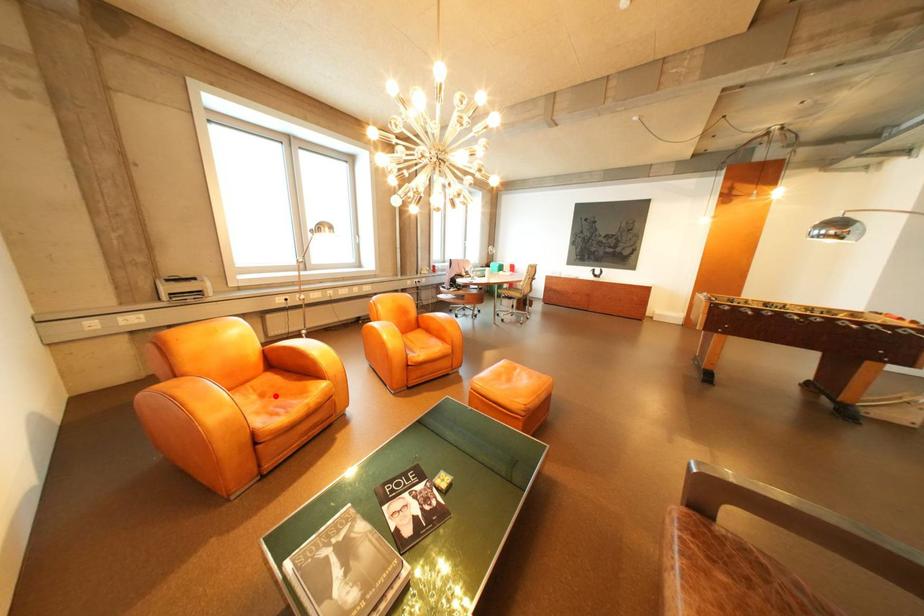
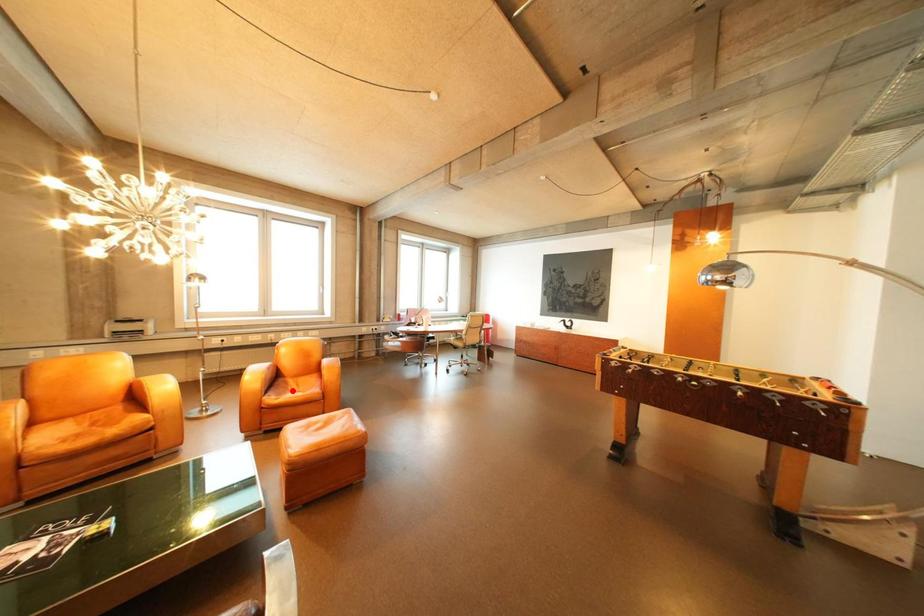
I am providing you with two images of the same scene from different viewpoints. A red point is marked on the first image and another point is marked on the second image. Is the red point in image1 aligned with the point shown in image2?

No